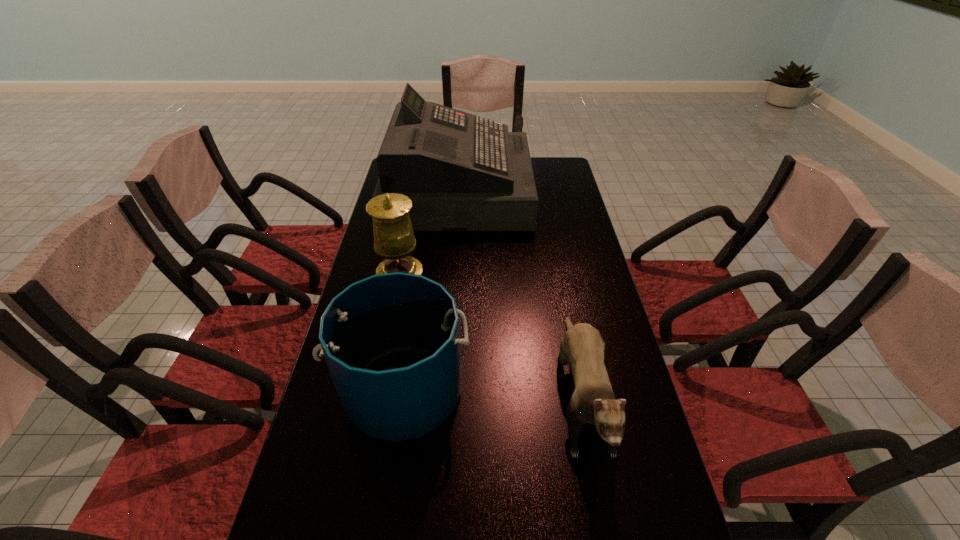
Identify the location of the farthest object. (462, 172).

What are the coordinates of `the third nearest object` in the screenshot? It's located at (394, 240).

You are a GUI agent. You are given a task and a screenshot of the screen. Output one action in this format:
    pyautogui.click(x=<x>, y=<y>)
    Task: Click on the third tallest object
    The width and height of the screenshot is (960, 540).
    Given the screenshot: What is the action you would take?
    pyautogui.click(x=391, y=341)

Find the location of a particular element. the shortest object is located at coordinates (x=582, y=346).

I want to click on vacant area located 0.060m on the front-facing side of the farthest object, so click(x=544, y=192).

You are a GUI agent. You are given a task and a screenshot of the screen. Output one action in this format:
    pyautogui.click(x=<x>, y=<y>)
    Task: Click on the vacant space situated 0.360m on the back of the second farthest object
    Image resolution: width=960 pixels, height=540 pixels.
    Given the screenshot: What is the action you would take?
    pyautogui.click(x=417, y=207)

This screenshot has height=540, width=960. Identify the location of vacant area situated on the right of the bucket. (533, 391).

Where is `free space located 0.050m on the face of the ferret`? The height and width of the screenshot is (540, 960). free space located 0.050m on the face of the ferret is located at coordinates [x=605, y=512].

Identify the location of object at the far edge. (462, 172).

Identify the location of cash register that is at the left edge. (462, 172).